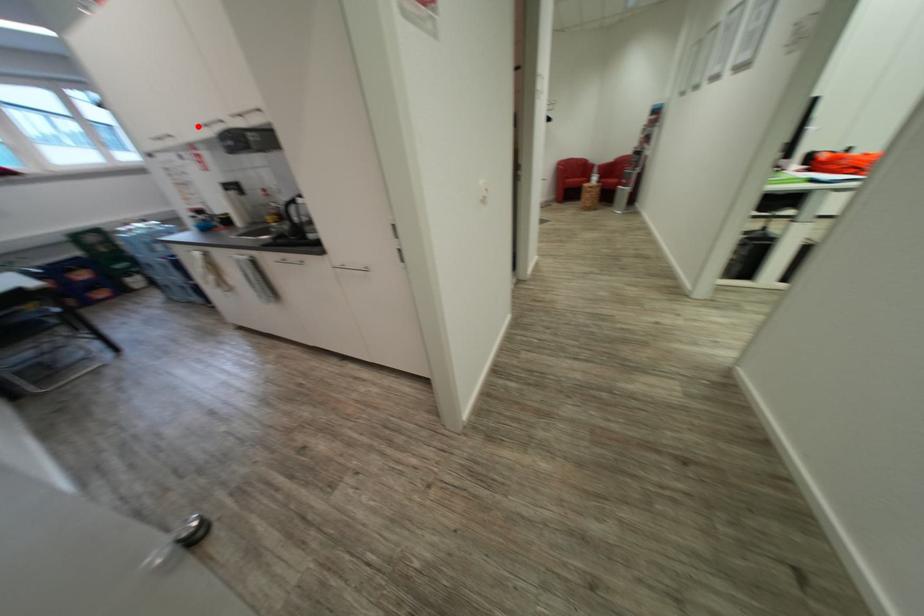
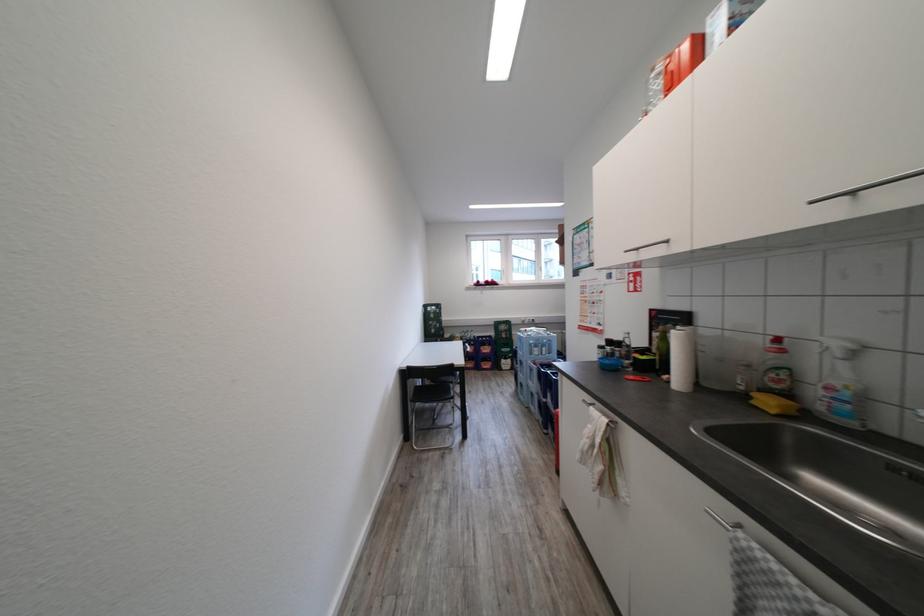
In the second image, find the point that corresponds to the highlighted location in the first image.

(811, 201)